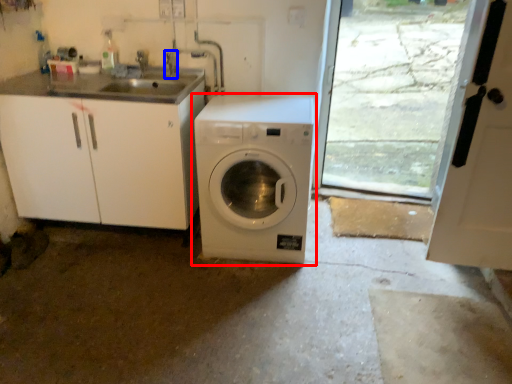
Question: Which of the following is the closest to the observer, washing machine (highlighted by a red box) or faucet (highlighted by a blue box)?

Choices:
 (A) washing machine
 (B) faucet

Answer: (A)